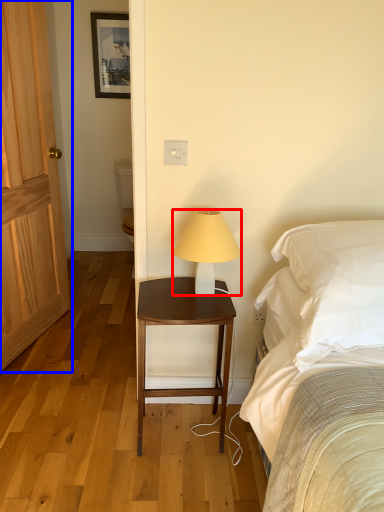
Question: Among these objects, which one is farthest to the camera, lamp (highlighted by a red box) or door (highlighted by a blue box)?

Choices:
 (A) lamp
 (B) door

Answer: (B)